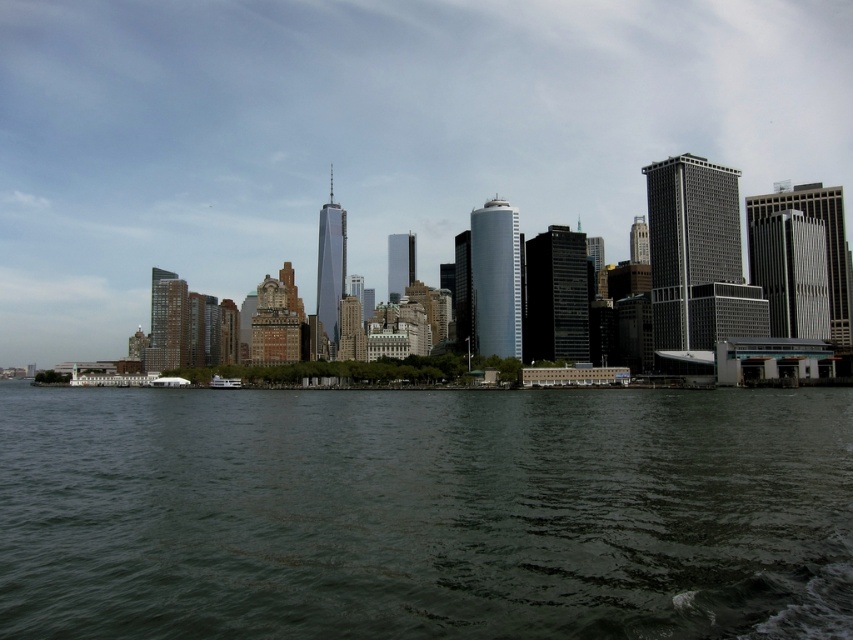
Question: Which object is the farthest from the white glossy boat at center?

Choices:
 (A) dark green water at center
 (B) transparent glass skyscraper at center

Answer: (B)

Question: Which is nearer to the dark green water at center?

Choices:
 (A) white glossy boat at center
 (B) transparent glass skyscraper at center

Answer: (A)

Question: Is transparent glass skyscraper at center bigger than dark green water at center?

Choices:
 (A) no
 (B) yes

Answer: (B)

Question: Where is transparent glass skyscraper at center located in relation to white glossy boat at center in the image?

Choices:
 (A) right
 (B) left

Answer: (A)

Question: Which point is farther to the camera?

Choices:
 (A) white glossy boat at center
 (B) dark green water at center

Answer: (A)

Question: Does transparent glass skyscraper at center appear over dark green water at center?

Choices:
 (A) no
 (B) yes

Answer: (B)